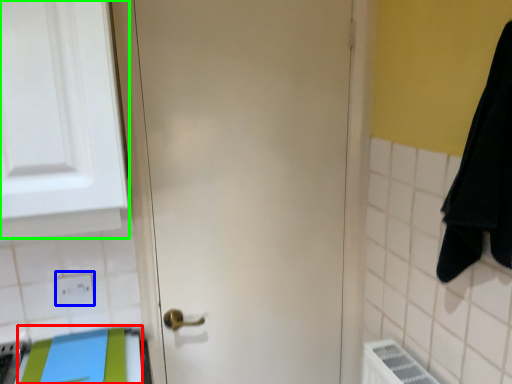
Question: Which object is the farthest from beach towel (highlighted by a red box)? Choose among these: electric outlet (highlighted by a blue box) or medicine cabinet (highlighted by a green box).

Choices:
 (A) electric outlet
 (B) medicine cabinet

Answer: (B)